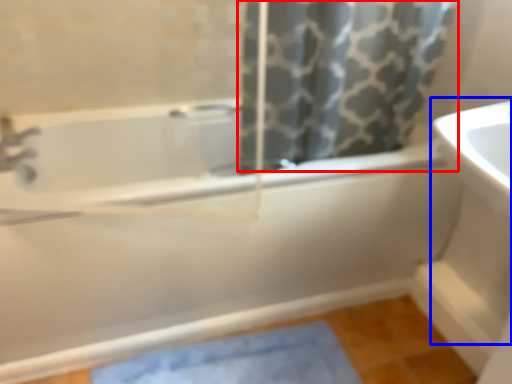
Question: Among these objects, which one is farthest to the camera, shower curtain (highlighted by a red box) or sink (highlighted by a blue box)?

Choices:
 (A) shower curtain
 (B) sink

Answer: (A)